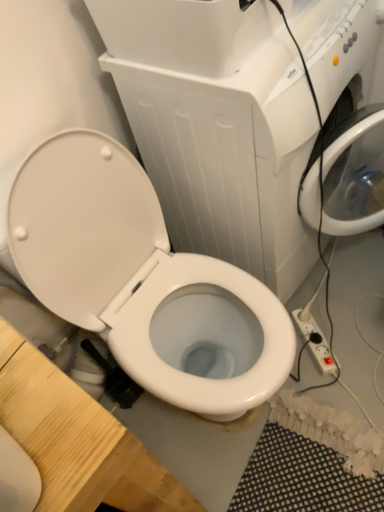
Question: Does white glossy toilet at center come in front of white plastic power strip at lower right?

Choices:
 (A) no
 (B) yes

Answer: (B)

Question: From the image's perspective, is white glossy toilet at center on top of white plastic power strip at lower right?

Choices:
 (A) yes
 (B) no

Answer: (A)

Question: Is white glossy toilet at center smaller than white plastic power strip at lower right?

Choices:
 (A) no
 (B) yes

Answer: (A)

Question: Would you say white glossy toilet at center is a long distance from white plastic power strip at lower right?

Choices:
 (A) no
 (B) yes

Answer: (A)

Question: Can you confirm if white glossy toilet at center is positioned to the right of white plastic power strip at lower right?

Choices:
 (A) yes
 (B) no

Answer: (B)

Question: From the image's perspective, is white plastic power strip at lower right positioned above or below white glossy toilet at center?

Choices:
 (A) below
 (B) above

Answer: (A)

Question: From a real-world perspective, is white plastic power strip at lower right physically located above or below white glossy toilet at center?

Choices:
 (A) below
 (B) above

Answer: (A)

Question: Is white plastic power strip at lower right bigger or smaller than white glossy toilet at center?

Choices:
 (A) big
 (B) small

Answer: (B)

Question: In terms of height, does white plastic power strip at lower right look taller or shorter compared to white glossy toilet at center?

Choices:
 (A) tall
 (B) short

Answer: (B)

Question: From the image's perspective, is white glossy toilet at center positioned above or below white glossy toilet at center?

Choices:
 (A) below
 (B) above

Answer: (A)

Question: In terms of width, does white glossy toilet at center look wider or thinner when compared to white glossy toilet at center?

Choices:
 (A) wide
 (B) thin

Answer: (A)

Question: Considering the positions of white glossy toilet at center and white glossy toilet at center in the image, is white glossy toilet at center bigger or smaller than white glossy toilet at center?

Choices:
 (A) big
 (B) small

Answer: (B)

Question: Is white glossy toilet at center in front of or behind white glossy toilet at center in the image?

Choices:
 (A) front
 (B) behind

Answer: (A)

Question: In the image, is white plastic power strip at lower right on the left side or the right side of white glossy toilet at center?

Choices:
 (A) left
 (B) right

Answer: (B)

Question: Is white plastic power strip at lower right wider or thinner than white glossy toilet at center?

Choices:
 (A) wide
 (B) thin

Answer: (B)